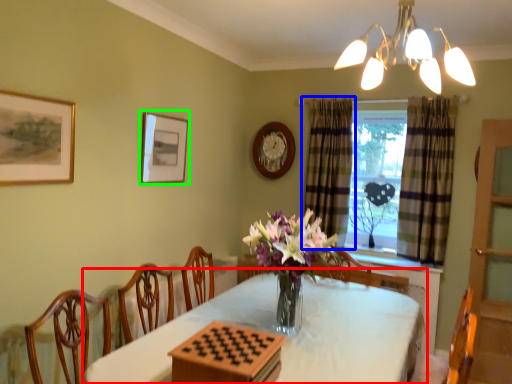
Question: Considering the real-world distances, which object is farthest from table (highlighted by a red box)? curtain (highlighted by a blue box) or picture frame (highlighted by a green box)?

Choices:
 (A) curtain
 (B) picture frame

Answer: (A)